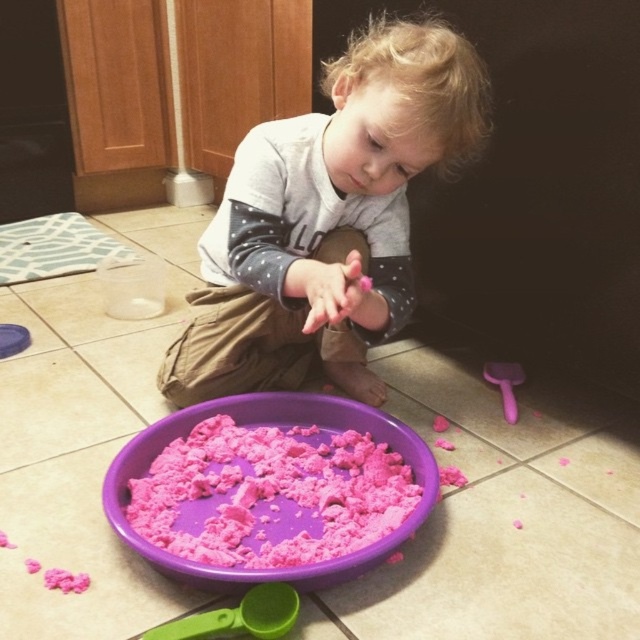
Who is taller, matte gray shirt at center or green plastic spoon at lower left?

matte gray shirt at center is taller.

What do you see at coordinates (326, 220) in the screenshot?
I see `matte gray shirt at center` at bounding box center [326, 220].

I want to click on matte gray shirt at center, so click(x=326, y=220).

Is purple plastic bowl at lower center positioned in front of pink plastic scoop at lower right?

Yes, it is in front of pink plastic scoop at lower right.

Does point (196, 580) lie behind point (509, 378)?

No, it is not.

Is point (369, 428) positioned before point (518, 372)?

That is True.

You are a GUI agent. You are given a task and a screenshot of the screen. Output one action in this format:
    pyautogui.click(x=<x>, y=<y>)
    Task: Click on the purple plastic bowl at lower center
    This screenshot has width=640, height=640.
    Given the screenshot: What is the action you would take?
    pyautogui.click(x=280, y=424)

Which is more to the right, matte gray shirt at center or pink plastic scoop at lower right?

pink plastic scoop at lower right is more to the right.

Is matte gray shirt at center bigger than pink plastic scoop at lower right?

Indeed, matte gray shirt at center has a larger size compared to pink plastic scoop at lower right.

The height and width of the screenshot is (640, 640). Identify the location of matte gray shirt at center. (326, 220).

Find the location of a particular element. The image size is (640, 640). matte gray shirt at center is located at coordinates (326, 220).